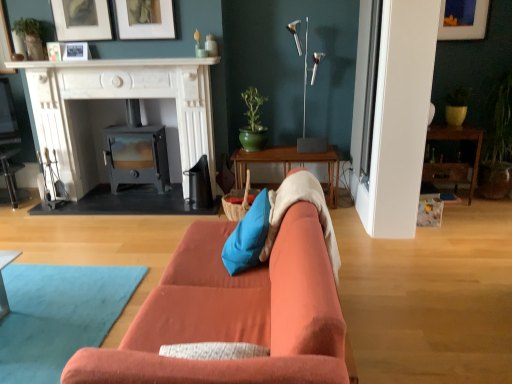
Identify the location of vacant space in front of matte white picture frame at upper left, which is counted as the first picture frame, starting from the left. This screenshot has height=384, width=512. (48, 63).